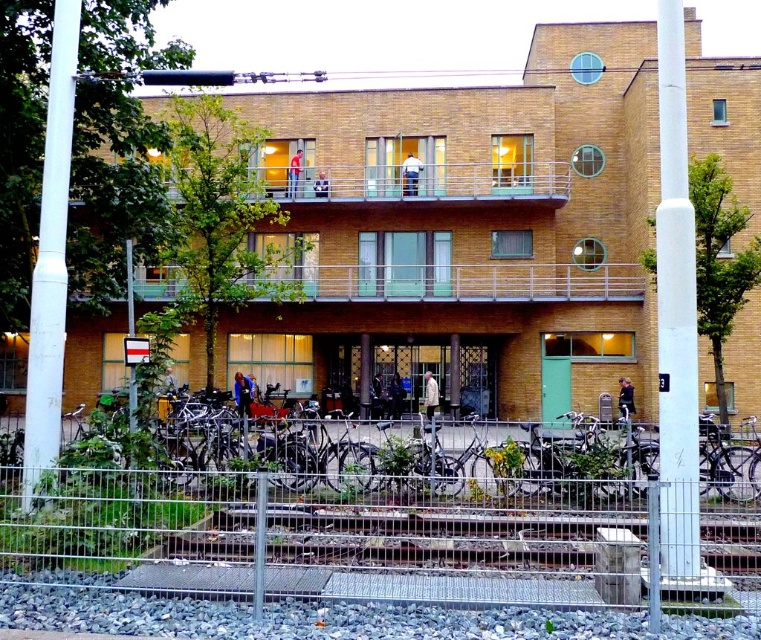
Question: Does white smooth pole at right have a smaller size compared to white smooth pole at left?

Choices:
 (A) no
 (B) yes

Answer: (B)

Question: Which of these objects is positioned farthest from the white smooth pole at left?

Choices:
 (A) white smooth pole at right
 (B) brown wooden balcony at upper center

Answer: (B)

Question: Observing the image, what is the correct spatial positioning of white smooth pole at left in reference to brown wooden balcony at upper center?

Choices:
 (A) below
 (B) above

Answer: (A)

Question: Which of the following is the closest to the observer?

Choices:
 (A) white smooth pole at left
 (B) brown wooden balcony at upper center
 (C) white smooth pole at right

Answer: (C)

Question: Which of the following is the closest to the observer?

Choices:
 (A) (664, 372)
 (B) (32, 451)
 (C) (255, 179)

Answer: (A)

Question: Is white smooth pole at left behind brown wooden balcony at upper center?

Choices:
 (A) no
 (B) yes

Answer: (A)